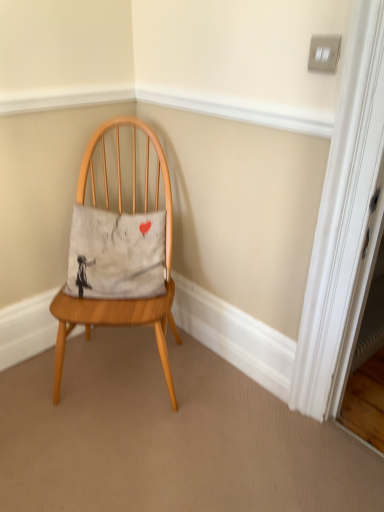
Question: From a real-world perspective, is wooden chair at center located beneath white cotton pillow at center?

Choices:
 (A) yes
 (B) no

Answer: (A)

Question: Considering the relative sizes of wooden chair at center and white cotton pillow at center in the image provided, is wooden chair at center smaller than white cotton pillow at center?

Choices:
 (A) yes
 (B) no

Answer: (B)

Question: Could you tell me if wooden chair at center is turned towards white cotton pillow at center?

Choices:
 (A) yes
 (B) no

Answer: (A)

Question: Is wooden chair at center turned away from white cotton pillow at center?

Choices:
 (A) yes
 (B) no

Answer: (A)

Question: Can you confirm if wooden chair at center is shorter than white cotton pillow at center?

Choices:
 (A) no
 (B) yes

Answer: (A)

Question: Does wooden chair at center appear on the right side of white cotton pillow at center?

Choices:
 (A) no
 (B) yes

Answer: (B)

Question: Is white cotton pillow at center outside wooden chair at center?

Choices:
 (A) no
 (B) yes

Answer: (A)

Question: Is white cotton pillow at center bigger than wooden chair at center?

Choices:
 (A) no
 (B) yes

Answer: (A)

Question: From the image's perspective, is white cotton pillow at center on wooden chair at center?

Choices:
 (A) yes
 (B) no

Answer: (A)

Question: Is wooden chair at center at the back of white cotton pillow at center?

Choices:
 (A) no
 (B) yes

Answer: (B)

Question: Can wooden chair at center be found inside white cotton pillow at center?

Choices:
 (A) yes
 (B) no

Answer: (B)

Question: Is white cotton pillow at center smaller than wooden chair at center?

Choices:
 (A) no
 (B) yes

Answer: (B)

Question: From a real-world perspective, relative to wooden chair at center, is white cotton pillow at center vertically above or below?

Choices:
 (A) above
 (B) below

Answer: (A)